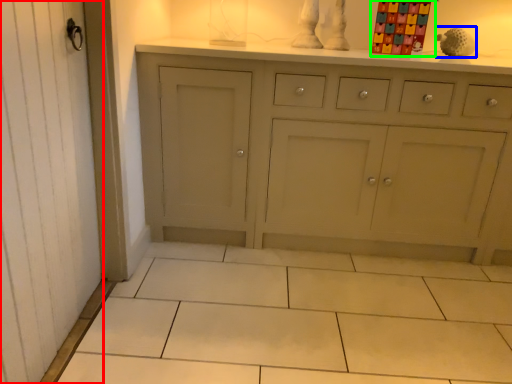
Question: Which object is positioned closest to screen door (highlighted by a red box)? Select from toy (highlighted by a blue box) and toy (highlighted by a green box).

Choices:
 (A) toy
 (B) toy

Answer: (B)